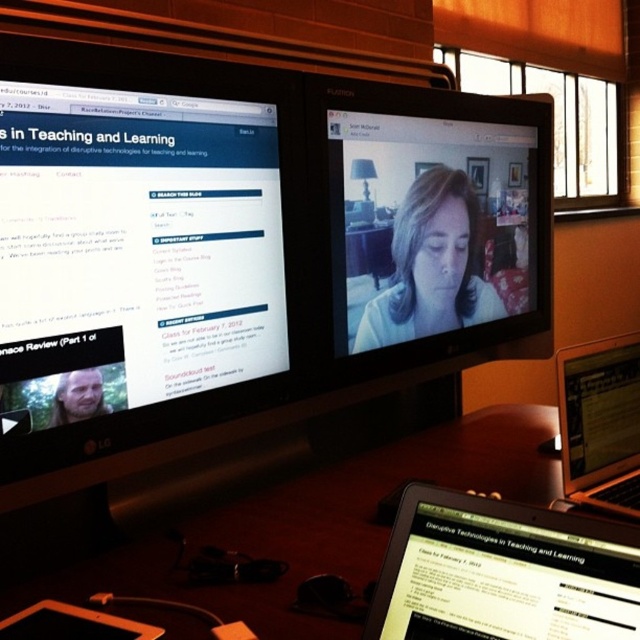
You are setting up a video call and need to ensure both the matte white face at center and the black glossy laptop at lower right are visible. Which object is wider, requiring more space in the frame?

The matte white face at center is wider than the black glossy laptop at lower right, so it requires more space in the frame.

You are organizing a virtual meeting and need to place your matte black tablet at lower right and black glossy laptop at lower right on your desk so they are exactly 30 inches apart. Given their current distance, do you need to move them closer or farther apart?

The matte black tablet at lower right and black glossy laptop at lower right are currently 28.73 inches apart. To reach the desired 30 inches, you need to move them farther apart.